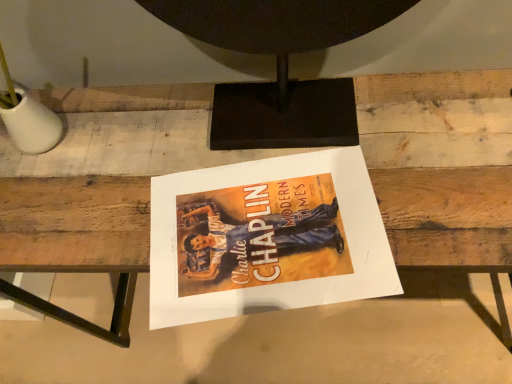
You are a GUI agent. You are given a task and a screenshot of the screen. Output one action in this format:
    pyautogui.click(x=<x>, y=<y>)
    Task: Click on the free location above wooden table at center (from a real-world perspective)
    This screenshot has width=512, height=384.
    Given the screenshot: What is the action you would take?
    pyautogui.click(x=259, y=166)